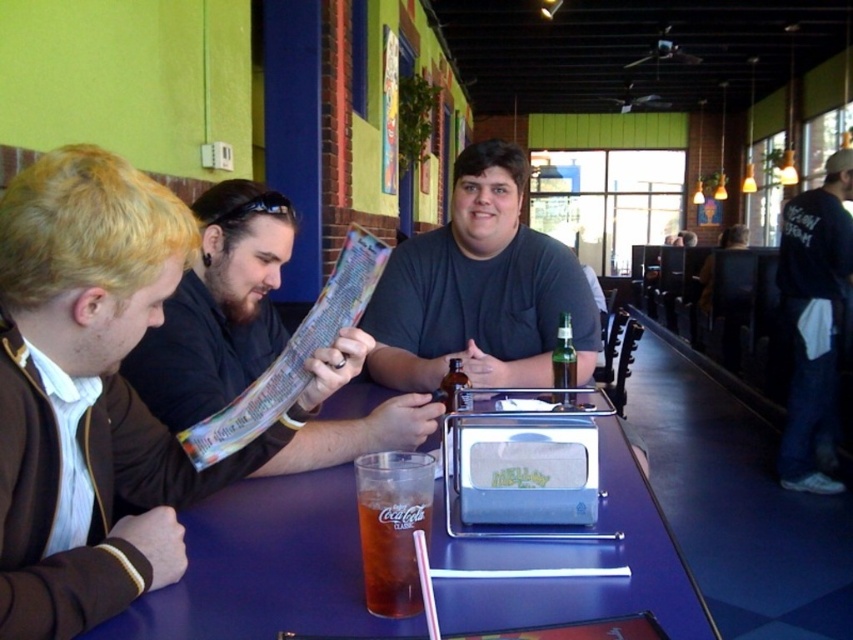
Question: Does purple plastic table at center appear over dark blue cotton shirt at right?

Choices:
 (A) no
 (B) yes

Answer: (A)

Question: Which object is positioned closest to the dark gray shirt at center?

Choices:
 (A) purple plastic table at center
 (B) black paper menu at center
 (C) dark blue cotton shirt at right

Answer: (B)

Question: Can you confirm if purple plastic table at center is bigger than green glass bottle at center?

Choices:
 (A) yes
 (B) no

Answer: (A)

Question: Which object appears farthest from the camera in this image?

Choices:
 (A) black paper menu at center
 (B) dark gray shirt at center

Answer: (B)

Question: Does black paper menu at center appear on the right side of translucent glass coca-cola at table center?

Choices:
 (A) yes
 (B) no

Answer: (B)

Question: Which point is farther to the camera?

Choices:
 (A) (521, 545)
 (B) (799, 474)
 (C) (569, 332)
 (D) (550, 243)

Answer: (B)